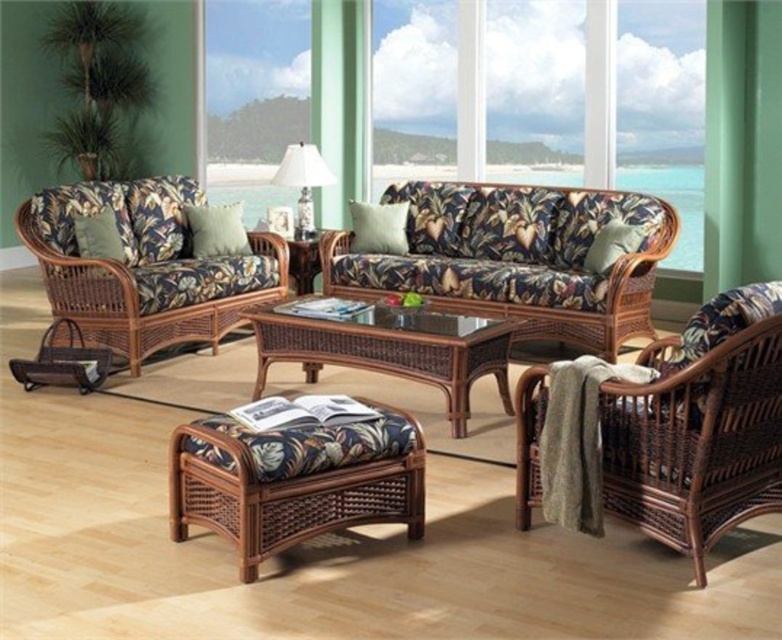
Between point (540, 253) and point (598, 268), which one is positioned behind?

The point (540, 253) is more distant.

What do you see at coordinates (515, 260) in the screenshot?
I see `brown wicker couch at center` at bounding box center [515, 260].

What do you see at coordinates (515, 260) in the screenshot? I see `brown wicker couch at center` at bounding box center [515, 260].

Find the location of a particular element. This screenshot has height=640, width=782. brown wicker couch at center is located at coordinates (515, 260).

Which is more to the right, matte wicker couch at upper center or white fabric pillow at center?

Positioned to the right is white fabric pillow at center.

Between point (255, 97) and point (353, 241), which one is positioned in front?

Point (353, 241) is in front.

Image resolution: width=782 pixels, height=640 pixels. I want to click on matte wicker couch at upper center, so click(x=662, y=112).

Is white glossy table lamp at center to the right of green fabric pillow at right from the viewer's perspective?

In fact, white glossy table lamp at center is to the left of green fabric pillow at right.

Describe the element at coordinates (303, 180) in the screenshot. I see `white glossy table lamp at center` at that location.

Locate an element on the screen. The height and width of the screenshot is (640, 782). white glossy table lamp at center is located at coordinates (303, 180).

Find the location of a particular element. This screenshot has width=782, height=640. white glossy table lamp at center is located at coordinates (303, 180).